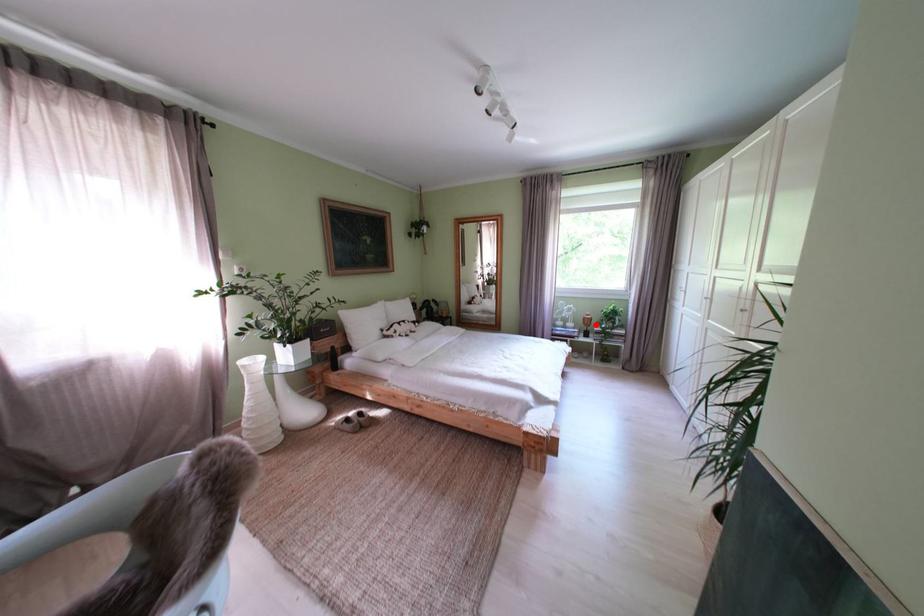
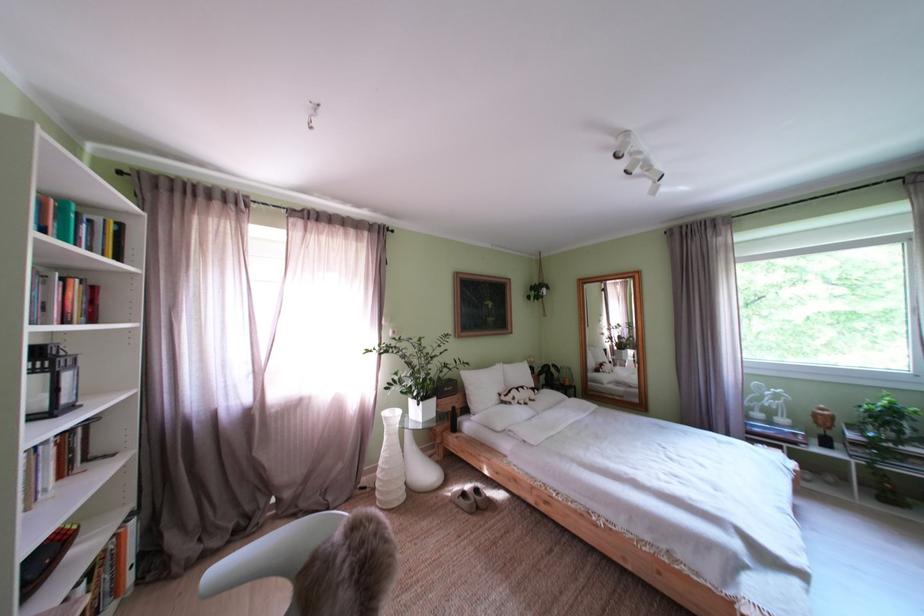
Find the pixel in the second image that matches the highlighted location in the first image.

(825, 419)